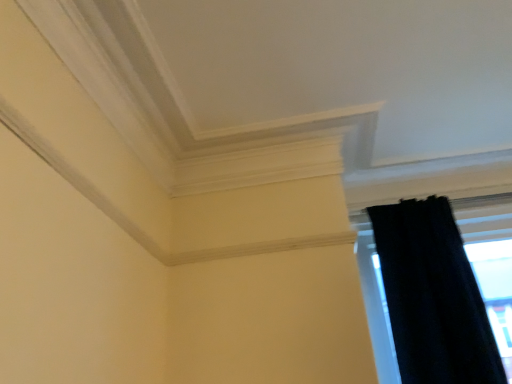
This screenshot has width=512, height=384. What do you see at coordinates (433, 296) in the screenshot?
I see `black textured curtain at right` at bounding box center [433, 296].

Where is `black textured curtain at right`? black textured curtain at right is located at coordinates (433, 296).

Locate an element on the screen. The height and width of the screenshot is (384, 512). black textured curtain at right is located at coordinates (433, 296).